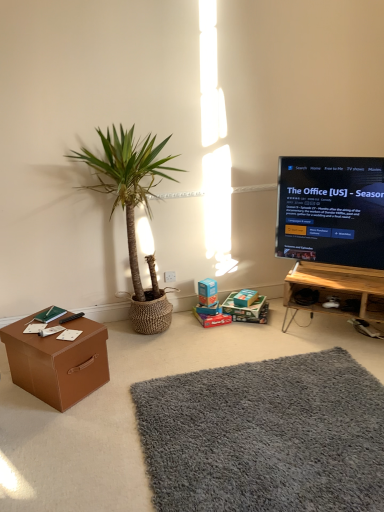
Question: Is gray shaggy rug at lower center at the left side of cardboard box at center, positioned as the 2th cardboard box in left-to-right order?

Choices:
 (A) yes
 (B) no

Answer: (B)

Question: Is gray shaggy rug at lower center outside of cardboard box at center, positioned as the 2th cardboard box in left-to-right order?

Choices:
 (A) no
 (B) yes

Answer: (B)

Question: From the image's perspective, does gray shaggy rug at lower center appear lower than cardboard box at center, positioned as the 2th cardboard box in left-to-right order?

Choices:
 (A) no
 (B) yes

Answer: (B)

Question: Is gray shaggy rug at lower center positioned behind cardboard box at center, which is counted as the first cardboard box, starting from the right?

Choices:
 (A) no
 (B) yes

Answer: (A)

Question: Does gray shaggy rug at lower center have a lesser height compared to cardboard box at center, which is counted as the first cardboard box, starting from the right?

Choices:
 (A) yes
 (B) no

Answer: (B)

Question: From the image's perspective, relative to green woven basket at left, is black glossy tv at right above or below?

Choices:
 (A) above
 (B) below

Answer: (A)

Question: Is black glossy tv at right wider or thinner than green woven basket at left?

Choices:
 (A) thin
 (B) wide

Answer: (A)

Question: Relative to green woven basket at left, is black glossy tv at right in front or behind?

Choices:
 (A) front
 (B) behind

Answer: (B)

Question: Based on their sizes in the image, would you say black glossy tv at right is bigger or smaller than green woven basket at left?

Choices:
 (A) big
 (B) small

Answer: (B)

Question: From the image's perspective, is black glossy tv at right above or below black plastic remote control at lower left?

Choices:
 (A) below
 (B) above

Answer: (B)

Question: Looking at their shapes, would you say black glossy tv at right is wider or thinner than black plastic remote control at lower left?

Choices:
 (A) wide
 (B) thin

Answer: (A)

Question: Is black glossy tv at right inside the boundaries of black plastic remote control at lower left, or outside?

Choices:
 (A) outside
 (B) inside

Answer: (A)

Question: Considering the positions of black glossy tv at right and black plastic remote control at lower left in the image, is black glossy tv at right bigger or smaller than black plastic remote control at lower left?

Choices:
 (A) big
 (B) small

Answer: (A)

Question: In the image, is matte brown cardboard box at lower center positioned in front of or behind blue cardboard box at center, which is the second box in back-to-front order?

Choices:
 (A) behind
 (B) front

Answer: (A)

Question: From a real-world perspective, is matte brown cardboard box at lower center above or below blue cardboard box at center, which is the second box in back-to-front order?

Choices:
 (A) below
 (B) above

Answer: (A)